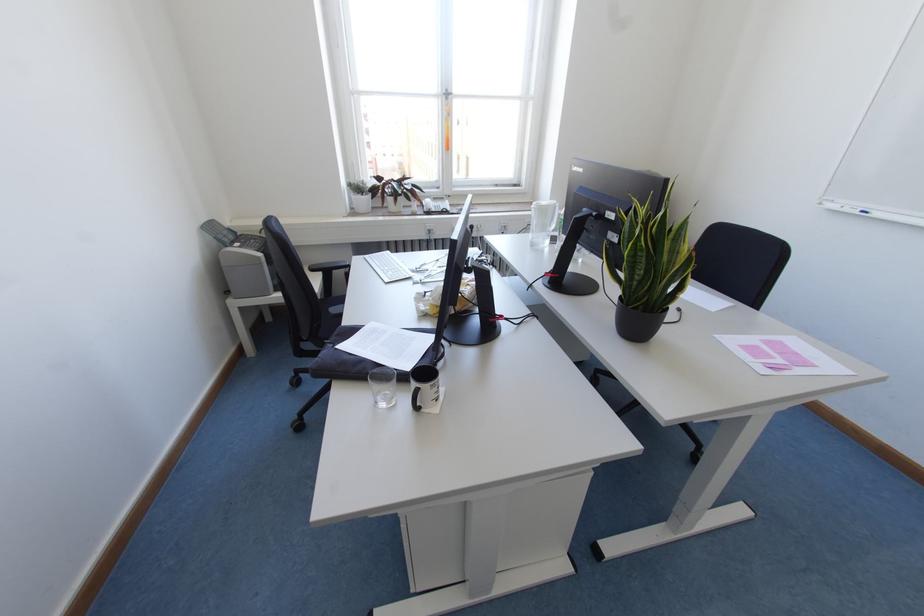
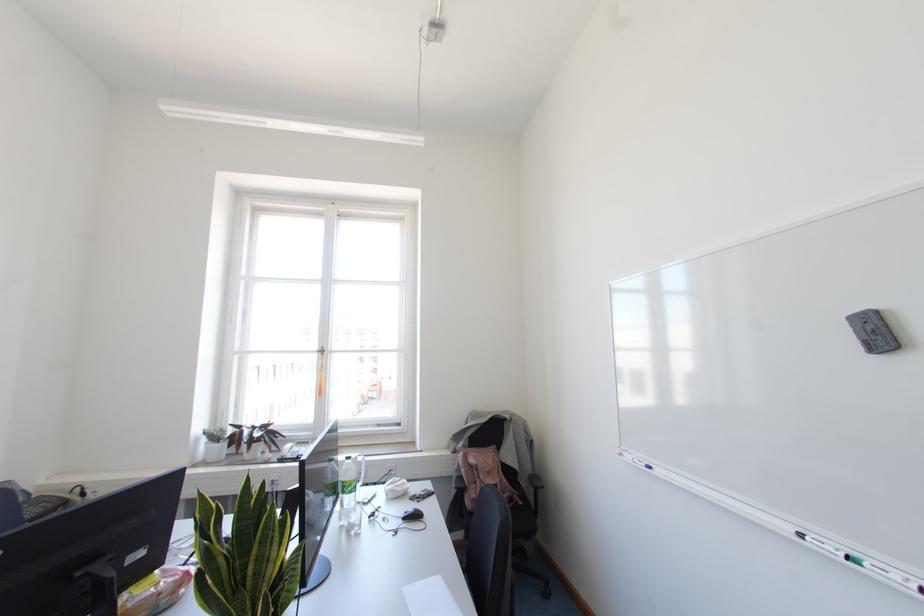
Find the pixel in the second image that matches [365,184] in the first image.

(223, 431)